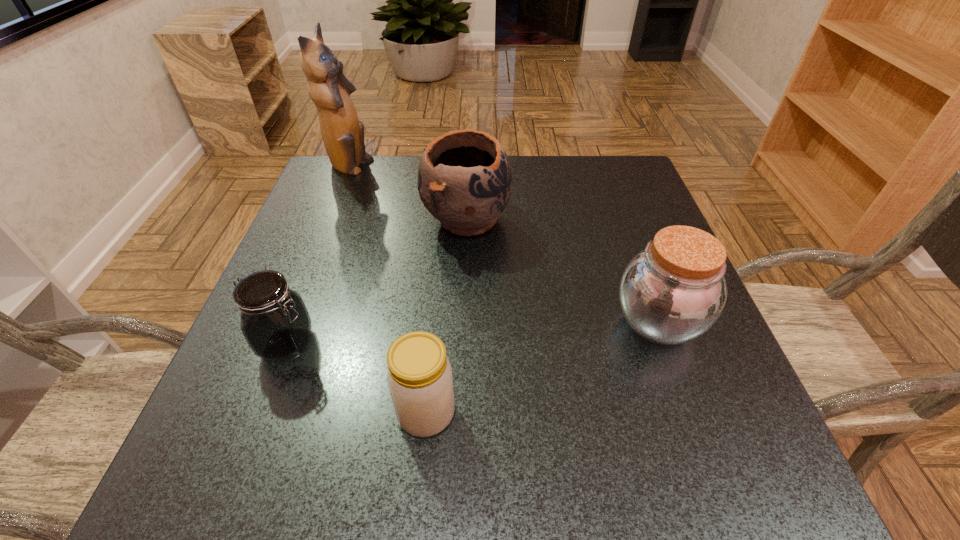
Find the location of a particular element. The height and width of the screenshot is (540, 960). free area in between the pottery and the tallest object is located at coordinates (408, 193).

I want to click on unoccupied position between the tallest object and the tallest jar, so click(503, 244).

This screenshot has height=540, width=960. I want to click on unoccupied area between the leftmost jar and the rightmost jar, so pos(472,333).

Find the location of `free spot between the leftmost jar and the pottery`. free spot between the leftmost jar and the pottery is located at coordinates (377, 281).

Identify the location of vacant area that lies between the tallest object and the nearest object. (388, 290).

Locate an element on the screen. The image size is (960, 540). free area in between the tallest jar and the leftmost jar is located at coordinates (472, 333).

Identify which object is the nearest to the rightmost jar. Please provide its 2D coordinates. Your answer should be formatted as a tuple, i.e. [(x, y)], where the tuple contains the x and y coordinates of a point satisfying the conditions above.

[(464, 178)]

Identify the location of object that is the fourth nearest to the rightmost jar. This screenshot has width=960, height=540. point(343,134).

Identify which jar is the third nearest to the farthest object. Please provide its 2D coordinates. Your answer should be formatted as a tuple, i.e. [(x, y)], where the tuple contains the x and y coordinates of a point satisfying the conditions above.

[(672, 292)]

Find the location of a particular element. The height and width of the screenshot is (540, 960). the closest jar to the nearest object is located at coordinates point(275,322).